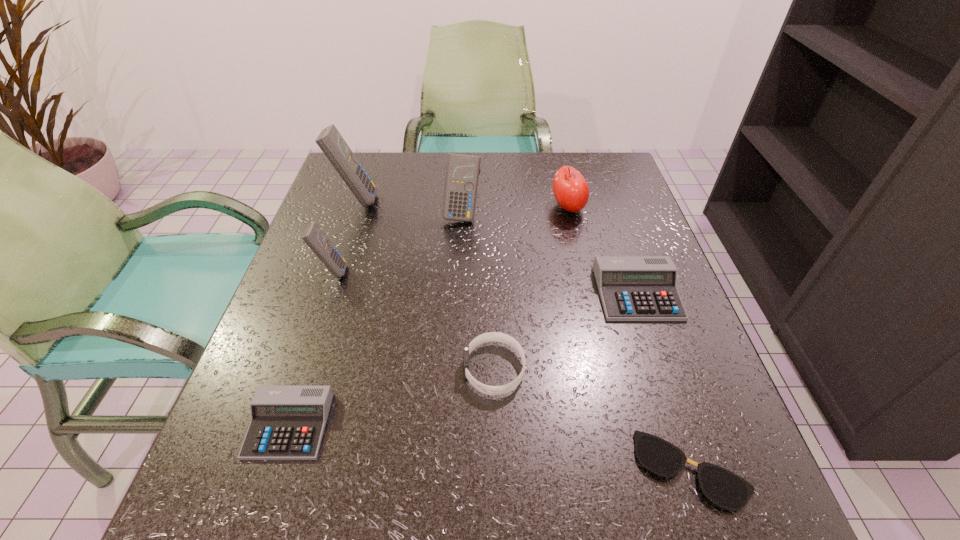
Image resolution: width=960 pixels, height=540 pixels. I want to click on object positioned at the far right corner, so click(571, 191).

Identify the location of object that is at the near right corner. (722, 487).

Identify the location of free space at the far edge of the desktop. Image resolution: width=960 pixels, height=540 pixels. (417, 191).

The width and height of the screenshot is (960, 540). Identify the location of free space at the near edge of the desktop. click(373, 504).

This screenshot has width=960, height=540. In the image, there is a desktop. Find the location of `free space at the left edge`. free space at the left edge is located at coordinates (292, 333).

In the image, there is a desktop. At what (x,y) coordinates should I click in order to perform the action: click on vacant space at the right edge. Please return your answer as a coordinate pair (x, y). Image resolution: width=960 pixels, height=540 pixels. Looking at the image, I should click on (642, 386).

In the image, there is a desktop. At what (x,y) coordinates should I click in order to perform the action: click on vacant space at the far right corner. Please return your answer as a coordinate pair (x, y). The width and height of the screenshot is (960, 540). Looking at the image, I should click on (612, 200).

In the image, there is a desktop. At what (x,y) coordinates should I click in order to perform the action: click on vacant area at the near right corner. Please return your answer as a coordinate pair (x, y). Image resolution: width=960 pixels, height=540 pixels. Looking at the image, I should click on point(678,505).

Identify the location of free space between the spectacles and the apple. Image resolution: width=960 pixels, height=540 pixels. (630, 339).

The image size is (960, 540). What are the coordinates of `vacant region between the spectacles and the second tallest object` in the screenshot? It's located at (577, 342).